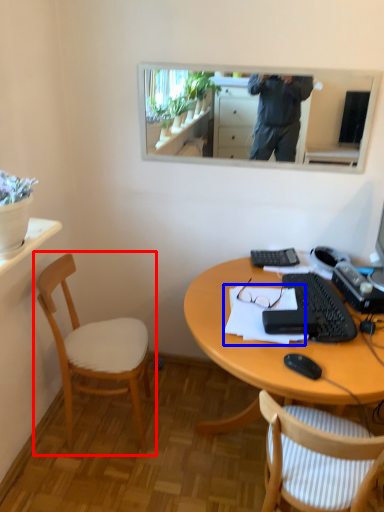
Question: Which object appears farthest to the camera in this image, chair (highlighted by a red box) or notepad (highlighted by a blue box)?

Choices:
 (A) chair
 (B) notepad

Answer: (A)